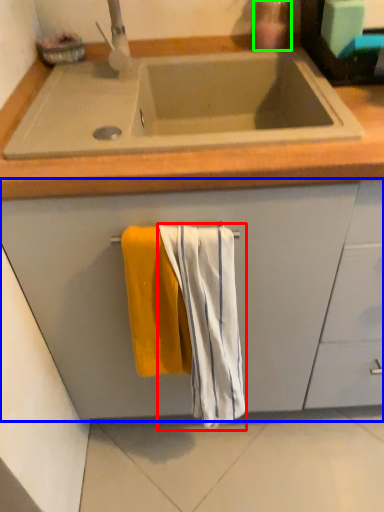
Question: Which is farther away from beach towel (highlighted by a red box)? cabinetry (highlighted by a blue box) or soap dispenser (highlighted by a green box)?

Choices:
 (A) cabinetry
 (B) soap dispenser

Answer: (B)